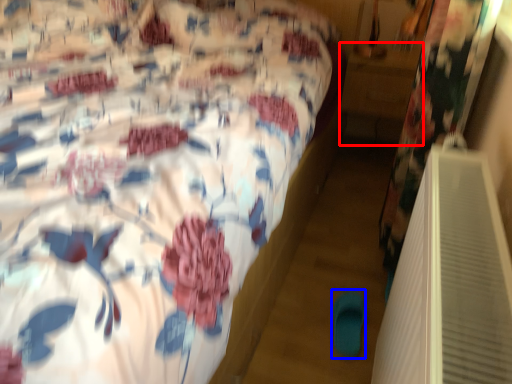
Question: Which of the following is the closest to the observer, table (highlighted by a red box) or slipper (highlighted by a blue box)?

Choices:
 (A) table
 (B) slipper

Answer: (B)